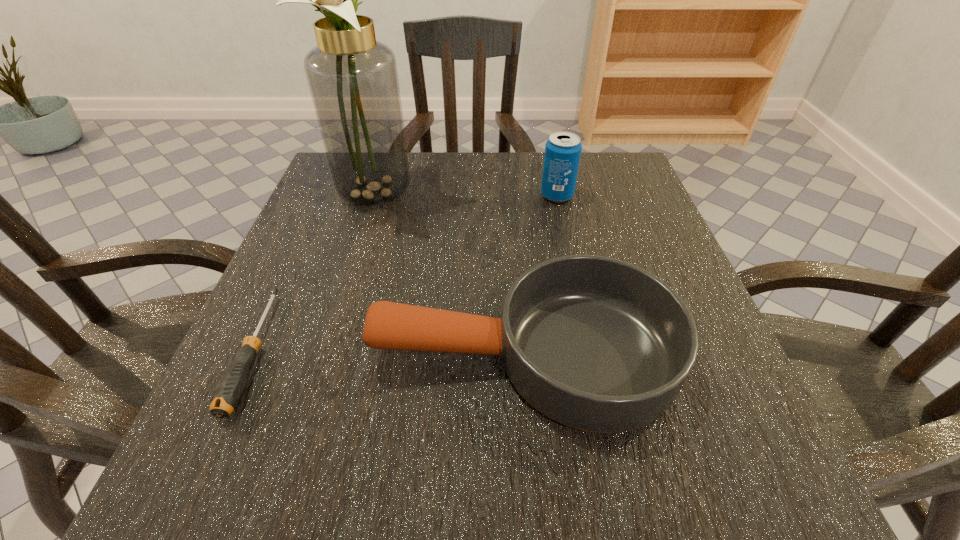
The image size is (960, 540). I want to click on free space located 0.380m on the right of the screwdriver, so click(x=516, y=352).

Image resolution: width=960 pixels, height=540 pixels. I want to click on flower arrangement at the far edge, so click(x=353, y=80).

You are a GUI agent. You are given a task and a screenshot of the screen. Output one action in this format:
    pyautogui.click(x=<x>, y=<y>)
    Task: Click on the soda can present at the far edge
    Image resolution: width=960 pixels, height=540 pixels.
    Given the screenshot: What is the action you would take?
    pyautogui.click(x=563, y=149)

Find the location of `object at the near edge`. object at the near edge is located at coordinates (597, 344).

In order to click on flower arrangement that is at the left edge in this screenshot , I will do `click(353, 80)`.

Locate an element on the screen. The image size is (960, 540). screwdriver that is at the left edge is located at coordinates (230, 388).

In order to click on soda can at the right edge in this screenshot , I will do `click(563, 149)`.

This screenshot has width=960, height=540. In order to click on pan that is at the right edge in this screenshot , I will do `click(597, 344)`.

Where is `object located in the far left corner section of the desktop`? object located in the far left corner section of the desktop is located at coordinates (353, 80).

At what (x,y) coordinates should I click in order to perform the action: click on object that is at the far right corner. Please return your answer as a coordinate pair (x, y). Looking at the image, I should click on (563, 149).